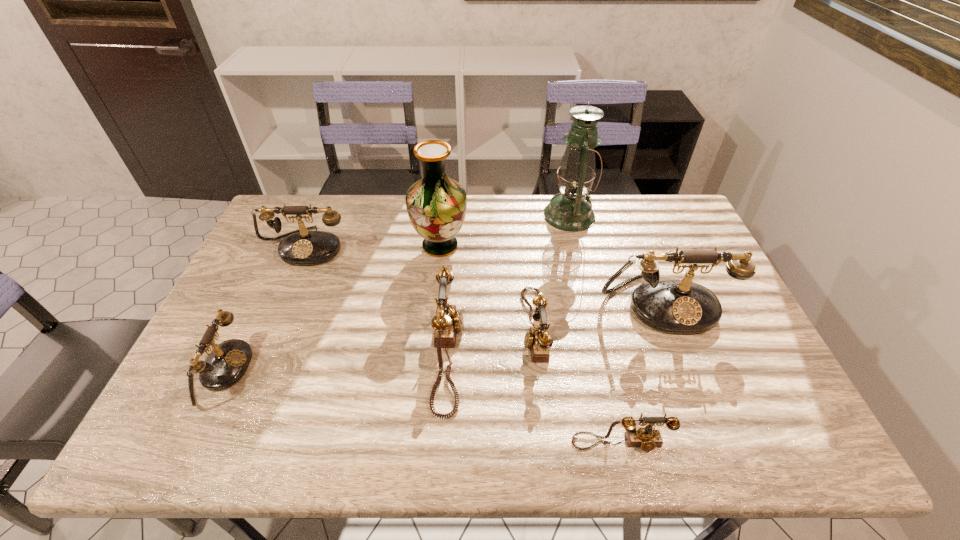
The width and height of the screenshot is (960, 540). What are the coordinates of `vacant space that is in between the farthest black telephone and the biggest brown telephone` in the screenshot? It's located at (377, 300).

Where is `object that stands as the second closest to the biggest brown telephone`? object that stands as the second closest to the biggest brown telephone is located at coordinates (537, 339).

Select which object is the fourth closest to the farthest black telephone. Please provide its 2D coordinates. Your answer should be formatted as a tuple, i.e. [(x, y)], where the tuple contains the x and y coordinates of a point satisfying the conditions above.

[(537, 339)]

Locate an element on the screen. The width and height of the screenshot is (960, 540). telephone object that ranks as the fifth closest to the second nearest black telephone is located at coordinates (226, 364).

Point out which telephone is positioned as the third nearest to the farthest black telephone. Please provide its 2D coordinates. Your answer should be formatted as a tuple, i.e. [(x, y)], where the tuple contains the x and y coordinates of a point satisfying the conditions above.

[(537, 339)]

Where is `black telephone that is the second closest to the rightmost black telephone`? Image resolution: width=960 pixels, height=540 pixels. black telephone that is the second closest to the rightmost black telephone is located at coordinates (226, 364).

Identify the location of black telephone identified as the closest to the nearest black telephone. (300, 247).

Locate an element on the screen. brown telephone that is the closest to the second brown telephone from right to left is located at coordinates (448, 320).

Where is `the third closest brown telephone to the sixth shortest object`? Image resolution: width=960 pixels, height=540 pixels. the third closest brown telephone to the sixth shortest object is located at coordinates (448, 320).